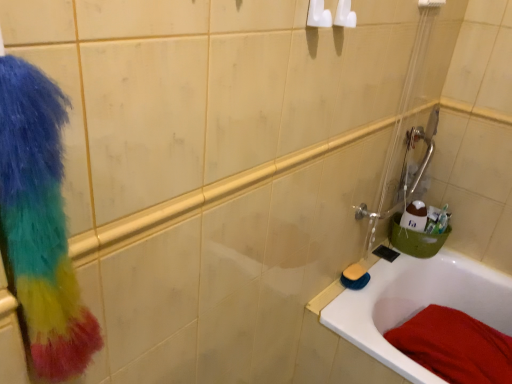
You are a GUI agent. You are given a task and a screenshot of the screen. Output one action in this format:
    pyautogui.click(x=<x>, y=<y>)
    Task: Click on the vacant space in front of yellow sponge at lower right
    The image size is (512, 384).
    Given the screenshot: What is the action you would take?
    pyautogui.click(x=347, y=304)